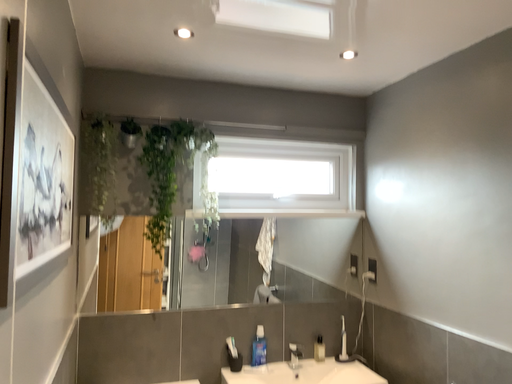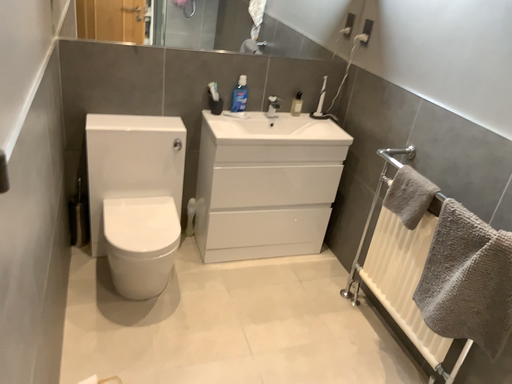
Question: Which way did the camera rotate in the video?

Choices:
 (A) rotated upward
 (B) rotated downward

Answer: (B)